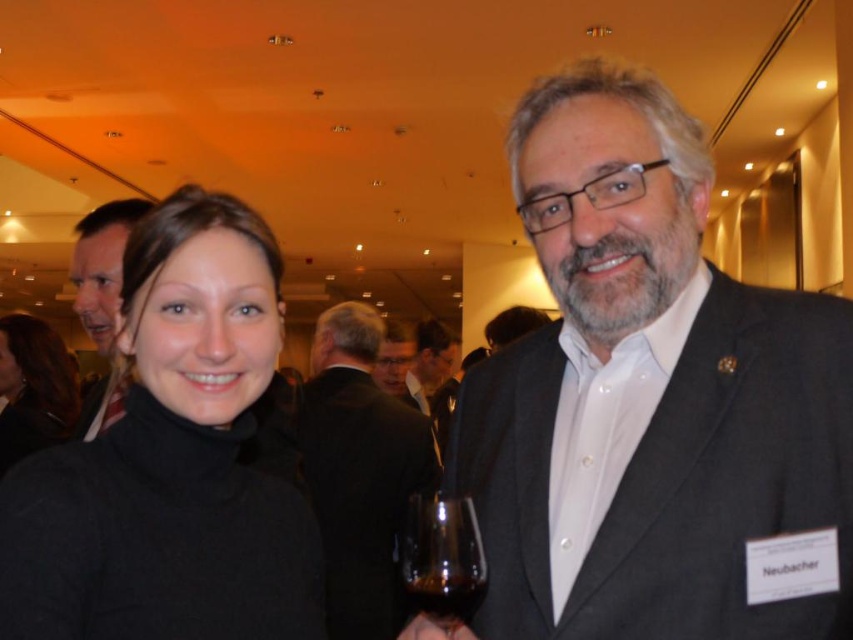
Who is more distant from viewer, (537, 371) or (170, 628)?

The point (537, 371) is behind.

Between matte black suit at center and black turtleneck sweater at center, which one appears on the left side from the viewer's perspective?

Positioned to the left is black turtleneck sweater at center.

Find the location of a particular element. matte black suit at center is located at coordinates (651, 403).

Does point (138, 230) lie behind point (106, 298)?

No, it is in front of (106, 298).

Who is more distant from viewer, (131, 605) or (103, 268)?

The point (103, 268) is behind.

I want to click on black turtleneck sweater at center, so click(x=171, y=460).

Who is shorter, dark gray suit at center or matte black glasses at center?

With less height is matte black glasses at center.

Does point (405, 392) come closer to viewer compared to point (376, 381)?

No.

This screenshot has width=853, height=640. In order to click on dark gray suit at center in this screenshot , I will do `click(428, 362)`.